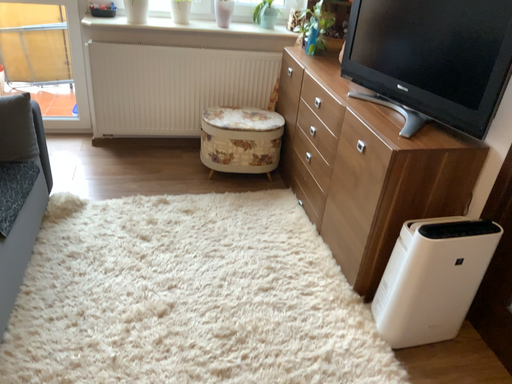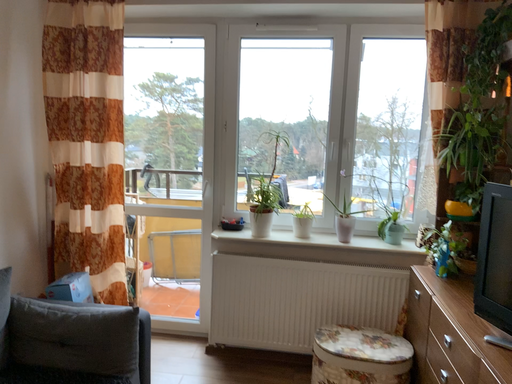
Question: How did the camera likely rotate when shooting the video?

Choices:
 (A) rotated downward
 (B) rotated upward

Answer: (B)